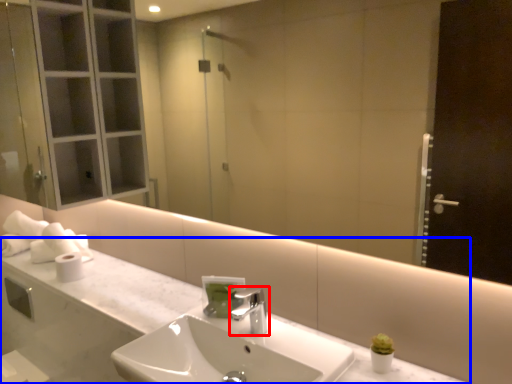
Question: Among these objects, which one is nearest to the camera, tap (highlighted by a red box) or counter top (highlighted by a blue box)?

Choices:
 (A) tap
 (B) counter top

Answer: (B)